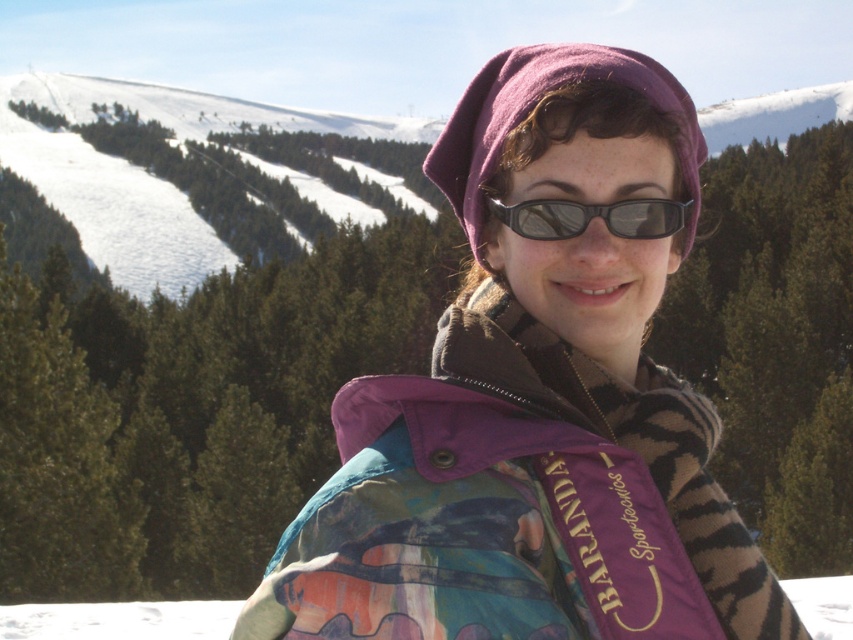
Question: Does purple fleece jacket at center have a greater width compared to black matte sunglasses at center?

Choices:
 (A) yes
 (B) no

Answer: (A)

Question: Which point is closer to the camera?

Choices:
 (A) black matte sunglasses at center
 (B) purple fleece jacket at center

Answer: (B)

Question: Is purple fleece jacket at center in front of black matte sunglasses at center?

Choices:
 (A) no
 (B) yes

Answer: (B)

Question: Can you confirm if purple fleece jacket at center is bigger than black matte sunglasses at center?

Choices:
 (A) no
 (B) yes

Answer: (B)